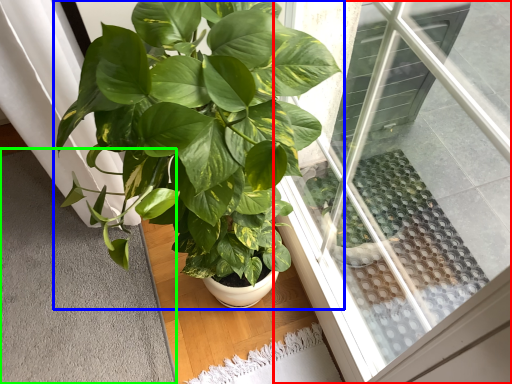
Question: Which is farther away from window (highlighted by a red box)? houseplant (highlighted by a blue box) or gray (highlighted by a green box)?

Choices:
 (A) houseplant
 (B) gray

Answer: (B)